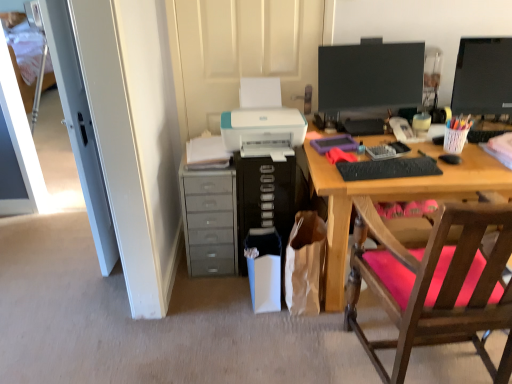
Question: Is white fabric bed at left located within black glossy monitor at upper right, which appears as the 1th computer monitor when viewed from the left?

Choices:
 (A) yes
 (B) no

Answer: (B)

Question: From the image's perspective, is black glossy monitor at upper right, the second computer monitor in the right-to-left sequence, over white fabric bed at left?

Choices:
 (A) no
 (B) yes

Answer: (A)

Question: Is black glossy monitor at upper right, the second computer monitor in the right-to-left sequence, placed right next to white fabric bed at left?

Choices:
 (A) no
 (B) yes

Answer: (A)

Question: Is black glossy monitor at upper right, the second computer monitor in the right-to-left sequence, at the left side of white fabric bed at left?

Choices:
 (A) no
 (B) yes

Answer: (A)

Question: From a real-world perspective, is black glossy monitor at upper right, which appears as the 1th computer monitor when viewed from the left, located beneath white fabric bed at left?

Choices:
 (A) no
 (B) yes

Answer: (A)

Question: Considering the relative sizes of black glossy monitor at upper right, which appears as the 1th computer monitor when viewed from the left, and white fabric bed at left in the image provided, is black glossy monitor at upper right, which appears as the 1th computer monitor when viewed from the left, smaller than white fabric bed at left?

Choices:
 (A) no
 (B) yes

Answer: (A)

Question: Is gray plastic drawers at lower left facing towards black glossy monitor at upper right, which appears as the 1th computer monitor when viewed from the left?

Choices:
 (A) no
 (B) yes

Answer: (A)

Question: Does gray plastic drawers at lower left contain black glossy monitor at upper right, the second computer monitor in the right-to-left sequence?

Choices:
 (A) no
 (B) yes

Answer: (A)

Question: Does gray plastic drawers at lower left have a greater width compared to black glossy monitor at upper right, which appears as the 1th computer monitor when viewed from the left?

Choices:
 (A) yes
 (B) no

Answer: (A)

Question: Is gray plastic drawers at lower left shorter than black glossy monitor at upper right, which appears as the 1th computer monitor when viewed from the left?

Choices:
 (A) no
 (B) yes

Answer: (A)

Question: Is gray plastic drawers at lower left turned away from black glossy monitor at upper right, which appears as the 1th computer monitor when viewed from the left?

Choices:
 (A) no
 (B) yes

Answer: (A)

Question: From the image's perspective, does gray plastic drawers at lower left appear lower than black glossy monitor at upper right, which appears as the 1th computer monitor when viewed from the left?

Choices:
 (A) no
 (B) yes

Answer: (B)

Question: Is white fabric bed at left located outside black plastic computer tower at center?

Choices:
 (A) yes
 (B) no

Answer: (A)